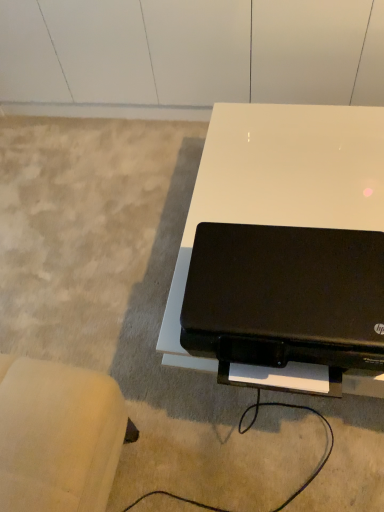
You are a GUI agent. You are given a task and a screenshot of the screen. Output one action in this format:
    pyautogui.click(x=<x>, y=<y>)
    Task: Click on the black matte laptop at lower right
    This screenshot has height=512, width=384.
    Given the screenshot: What is the action you would take?
    pyautogui.click(x=286, y=298)

The image size is (384, 512). What do you see at coordinates (286, 298) in the screenshot?
I see `black matte laptop at lower right` at bounding box center [286, 298].

Locate an element on the screen. black matte laptop at lower right is located at coordinates (286, 298).